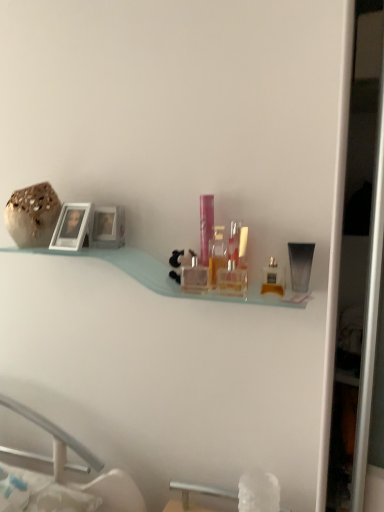
Question: Relative to clear glass perfume bottle at center, the eighth toiletry in the right-to-left sequence, is transparent plastic tube at right, which appears as the 8th toiletry when viewed from the left, in front or behind?

Choices:
 (A) behind
 (B) front

Answer: (B)

Question: In terms of width, does transparent plastic tube at right, the first toiletry when ordered from right to left, look wider or thinner when compared to clear glass perfume bottle at center, the eighth toiletry in the right-to-left sequence?

Choices:
 (A) thin
 (B) wide

Answer: (A)

Question: Which object is positioned farthest from the matte silver picture frame at left?

Choices:
 (A) translucent glass perfume bottle at center, the third toiletry positioned from the left
 (B) translucent plastic bottle at center, acting as the seventh toiletry starting from the left
 (C) pink plastic container at center, which is the 2th toiletry in left-to-right order
 (D) clear glass perfume bottle at center, which is the fifth toiletry from right to left
 (E) transparent plastic tube at right, which appears as the 8th toiletry when viewed from the left

Answer: (E)

Question: Considering the real-world distances, which object is closest to the translucent plastic bottle at center, which ranks as the 6th toiletry in left-to-right order?

Choices:
 (A) clear glass perfume bottle at center, which is the 4th toiletry in left-to-right order
 (B) speckled ceramic vase at upper left
 (C) matte silver picture frame at left
 (D) translucent glass perfume bottle at center, the third toiletry positioned from the left
 (E) clear plastic perfume bottle at center, the 4th toiletry positioned from the right

Answer: (E)